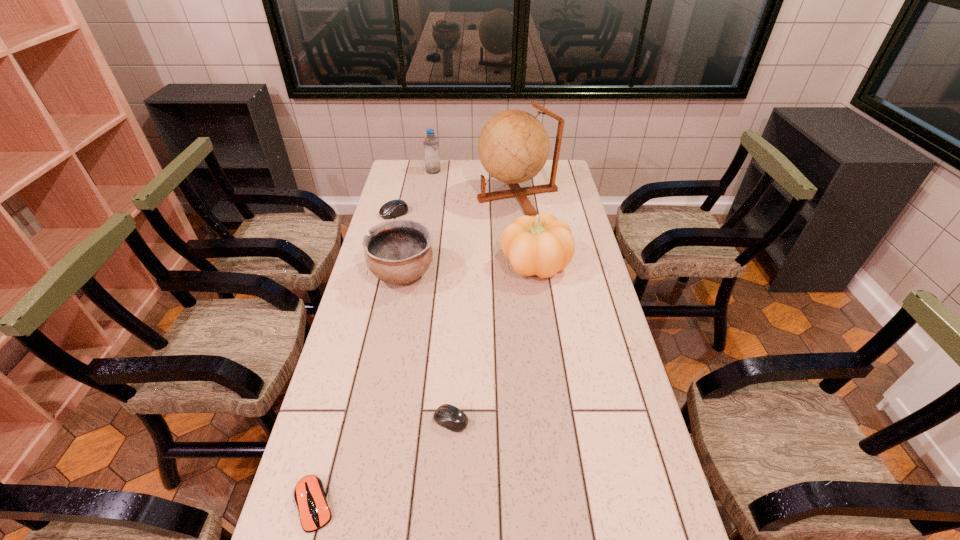
Locate an element on the screen. Image resolution: width=960 pixels, height=540 pixels. water bottle that is positioned at the far edge is located at coordinates (431, 144).

At what (x,y) coordinates should I click in order to perform the action: click on water bottle that is at the left edge. Please return your answer as a coordinate pair (x, y). The height and width of the screenshot is (540, 960). Looking at the image, I should click on (431, 144).

This screenshot has width=960, height=540. I want to click on pottery that is positioned at the left edge, so click(398, 251).

The width and height of the screenshot is (960, 540). Find the location of `globe that is at the right edge`. globe that is at the right edge is located at coordinates (513, 146).

At what (x,y) coordinates should I click in order to perform the action: click on pumpkin that is at the right edge. Please return your answer as a coordinate pair (x, y). The width and height of the screenshot is (960, 540). Looking at the image, I should click on (542, 245).

Locate an element on the screen. The width and height of the screenshot is (960, 540). object at the far left corner is located at coordinates (431, 144).

Find the location of a particular element. object that is positioned at the far right corner is located at coordinates (513, 146).

In the image, there is a desktop. What are the coordinates of `free space at the right edge` in the screenshot? It's located at (567, 270).

In the image, there is a desktop. Identify the location of vacant space at the far left corner. This screenshot has height=540, width=960. (395, 161).

Where is `free space at the far right corner of the desktop`? Image resolution: width=960 pixels, height=540 pixels. free space at the far right corner of the desktop is located at coordinates (556, 182).